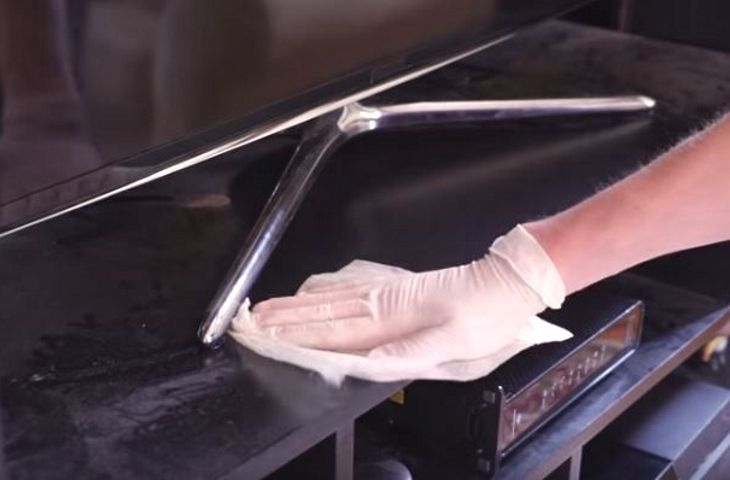
Locate an element on the screen. The height and width of the screenshot is (480, 730). desk is located at coordinates (396, 205).